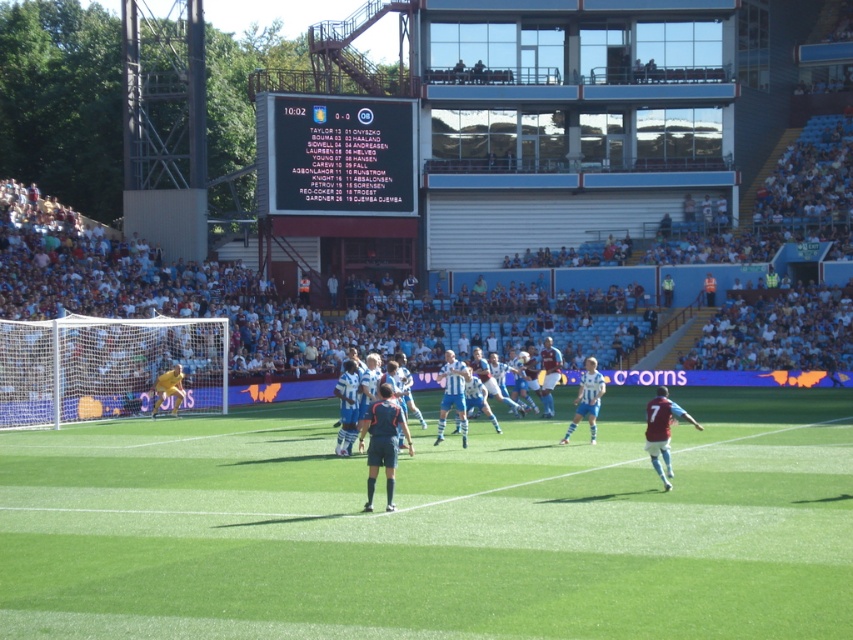
You are a photographer positioned at the edge of the soccer field. You want to take a photo of the maroon jersey at center. What are the coordinates where you should aim your camera?

The maroon jersey at center is located at coordinates 0.675 on the x axis and 0.777 on the y axis, so you should aim your camera at those coordinates to capture it.

You are a photographer at the soccer match and want to capture a photo of both the blue fabric jersey at center and the blue jersey at center in the same frame. Based on their positions, which one is positioned higher in the image?

The blue fabric jersey at center is located above the blue jersey at center, so it is positioned higher in the image.

You are a soccer coach observing the match. You notice two players wearing maroon jersey at center and blue jersey at center. Which player is positioned to the right side of the field?

The maroon jersey at center is positioned to the right of the blue jersey at center, so the player in the maroon jersey at center is on the right side of the field.